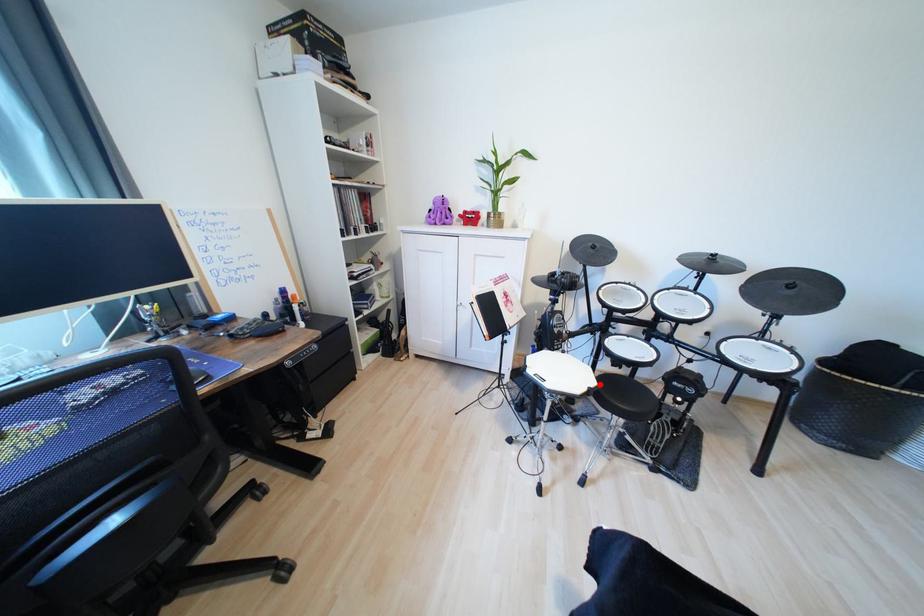
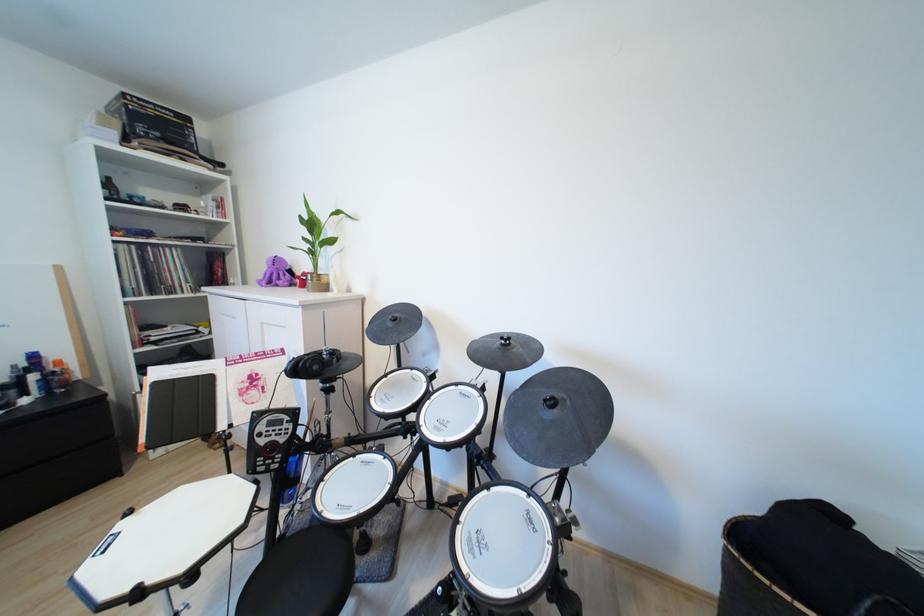
Locate, in the second image, the point that corresponds to the highlighted location in the first image.

(190, 568)